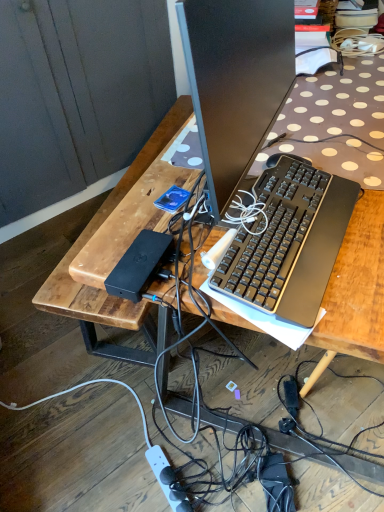
Question: From the image's perspective, is black plastic keyboard at center above or below white plastic power outlet at lower center?

Choices:
 (A) above
 (B) below

Answer: (A)

Question: Is black plastic keyboard at center in front of or behind white plastic power outlet at lower center in the image?

Choices:
 (A) front
 (B) behind

Answer: (A)

Question: Estimate the real-world distances between objects in this image. Which object is farther from the wooden desk at center?

Choices:
 (A) white plastic power outlet at lower center
 (B) black plastic keyboard at center

Answer: (A)

Question: Which of these objects is positioned closest to the white plastic power outlet at lower center?

Choices:
 (A) wooden desk at center
 (B) black plastic keyboard at center

Answer: (A)